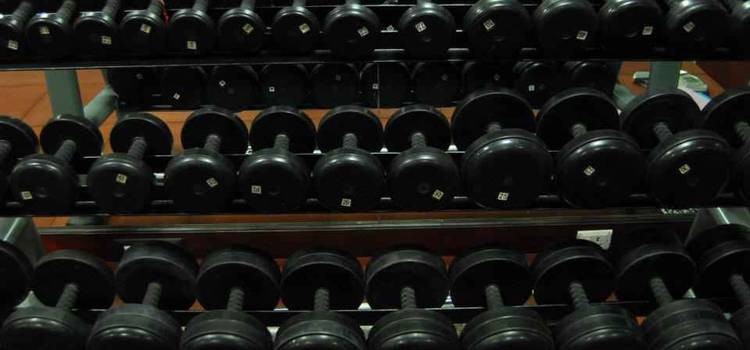
At what (x,y) coordinates should I click in order to perform the action: click on dumbbell rack. Please return your answer as a coordinate pair (x, y). The width and height of the screenshot is (750, 350). Looking at the image, I should click on (370, 230).